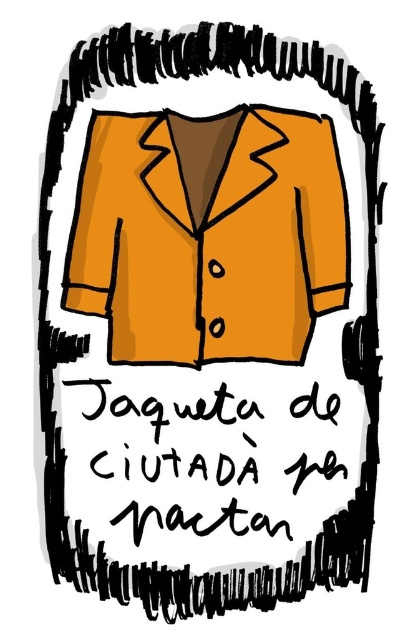
You are an artist who just finished drawing the orange matte jacket at center and the black handwritten text at center. Now you want to add a border around the entire image. Which object should you draw the border around first to ensure it encloses both objects properly?

The orange matte jacket at center is taller than the black handwritten text at center, so you should draw the border around the orange matte jacket at center first to ensure it encloses both objects properly.

You are an artist who wants to add a new element to your drawing. You have the orange matte jacket at center and the black handwritten text at center. Which object should you modify to ensure the text is visible?

The orange matte jacket at center is in front of the black handwritten text at center, so you should modify the orange matte jacket at center to move it away or adjust its position so the text becomes visible.